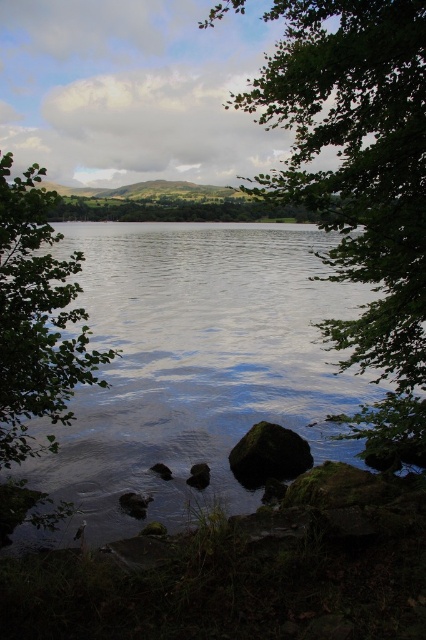
Is clear water at center bigger than green leafy tree at left?

Yes.

Is clear water at center smaller than green leafy tree at left?

Incorrect, clear water at center is not smaller in size than green leafy tree at left.

Who is more forward, (192, 406) or (63, 296)?

Point (63, 296) is more forward.

Where is `clear water at center`? clear water at center is located at coordinates (195, 365).

What do you see at coordinates (195, 365) in the screenshot?
I see `clear water at center` at bounding box center [195, 365].

Does clear water at center have a lesser height compared to green leafy tree at center?

Yes, clear water at center is shorter than green leafy tree at center.

Who is more forward, [344,401] or [389,458]?

Point [389,458]

This screenshot has height=640, width=426. I want to click on clear water at center, so click(195, 365).

Who is more distant from viewer, (25, 417) or (238, 452)?

The point (238, 452) is more distant.

Looking at this image, does green leafy tree at left appear on the right side of green mossy rock at lower center?

No, green leafy tree at left is not to the right of green mossy rock at lower center.

Is point (69, 422) behind point (285, 448)?

That is False.

Where is `green leafy tree at left`? green leafy tree at left is located at coordinates (37, 320).